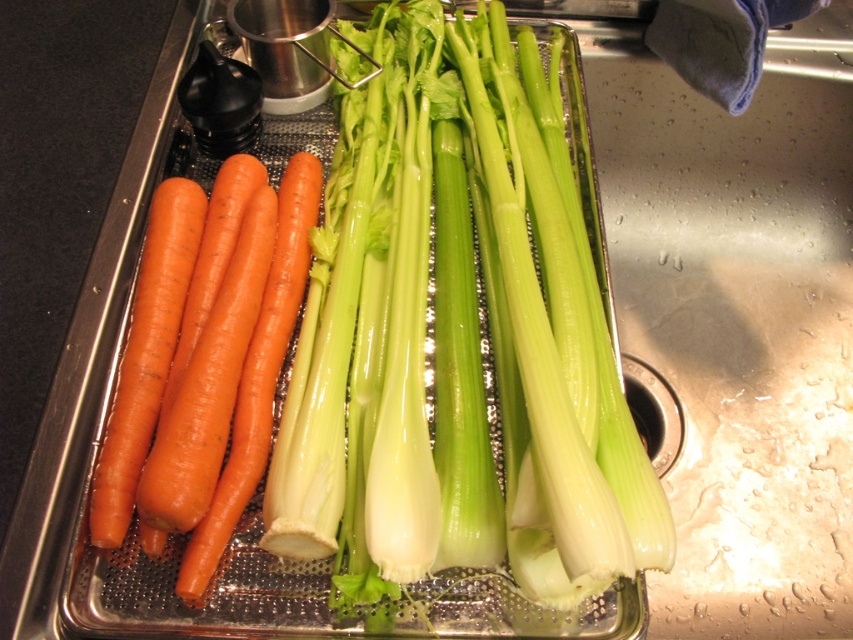
You are organizing vegetables in the sink tray. You need to place a small plate between the green glossy celery at center and the orange matte carrots at left. Can the plate fit between them if the plate is 10 cm wide?

The green glossy celery at center is wider than the orange matte carrots at left. However, the exact width difference isn

You are a chef preparing a vegetable platter and need to know the distance between the green glossy celery at center and the carrots on the left side. Can you determine if the distance is more than 50 centimeters?

The green glossy celery at center is 49.48 centimeters from viewer, so the distance between the green glossy celery at center and the carrots on the left side is less than 50 centimeters.

You are organizing vegetables in a stainless steel sink tray. You need to place the green glossy celery at center and the orange matte carrot at left in a specific order. Which vegetable should be placed on the left side of the tray?

The orange matte carrot at left should be placed on the left side of the tray since the green glossy celery at center is positioned to its right.